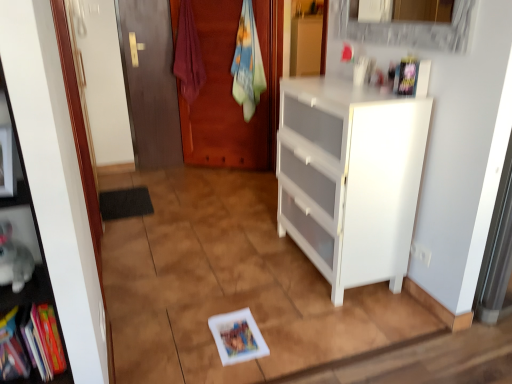
Question: Is matte red towel at center, which is counted as the first laundry, starting from the left, bigger than matte wood door at left?

Choices:
 (A) no
 (B) yes

Answer: (B)

Question: Is matte red towel at center, which is counted as the first laundry, starting from the left, smaller than matte wood door at left?

Choices:
 (A) yes
 (B) no

Answer: (B)

Question: Is the depth of matte red towel at center, the 2th laundry viewed from the right, less than that of matte wood door at left?

Choices:
 (A) yes
 (B) no

Answer: (A)

Question: Can you confirm if matte red towel at center, the 2th laundry viewed from the right, is positioned to the right of matte wood door at left?

Choices:
 (A) yes
 (B) no

Answer: (A)

Question: Considering the relative sizes of matte red towel at center, the 2th laundry viewed from the right, and matte wood door at left in the image provided, is matte red towel at center, the 2th laundry viewed from the right, wider than matte wood door at left?

Choices:
 (A) yes
 (B) no

Answer: (A)

Question: Is matte red towel at center, which is counted as the first laundry, starting from the left, facing away from matte wood door at left?

Choices:
 (A) no
 (B) yes

Answer: (A)

Question: Is multicolored fabric book at lower left, the fourth book in the right-to-left sequence, in contact with hardcover book at left, the third book when ordered from right to left?

Choices:
 (A) yes
 (B) no

Answer: (A)

Question: Does multicolored fabric book at lower left, which is the 3th book from top to bottom, have a larger size compared to hardcover book at left, the 2th book in the top-to-bottom sequence?

Choices:
 (A) no
 (B) yes

Answer: (A)

Question: From the image's perspective, is multicolored fabric book at lower left, the fourth book in the right-to-left sequence, located above hardcover book at left, the 2th book in the top-to-bottom sequence?

Choices:
 (A) no
 (B) yes

Answer: (A)

Question: From the image's perspective, does multicolored fabric book at lower left, the second book ordered from the bottom, appear lower than hardcover book at left, the 2th book in the top-to-bottom sequence?

Choices:
 (A) yes
 (B) no

Answer: (A)

Question: Could hardcover book at left, the 2th book in the top-to-bottom sequence, be considered to be inside multicolored fabric book at lower left, which is the 3th book from top to bottom?

Choices:
 (A) yes
 (B) no

Answer: (B)

Question: From a real-world perspective, is multicolored fabric book at lower left, which is the 3th book from top to bottom, positioned over hardcover book at left, the third book when ordered from right to left, based on gravity?

Choices:
 (A) yes
 (B) no

Answer: (B)

Question: Does matte wood door at left have a larger size compared to multicolored fabric towel at center, which appears as the second laundry when viewed from the left?

Choices:
 (A) no
 (B) yes

Answer: (A)